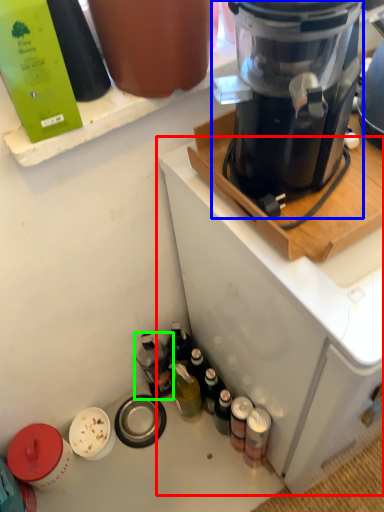
Question: Estimate the real-world distances between objects in this image. Which object is closer to home appliance (highlighted by a red box), blender (highlighted by a blue box) or bottle (highlighted by a green box)?

Choices:
 (A) blender
 (B) bottle

Answer: (A)